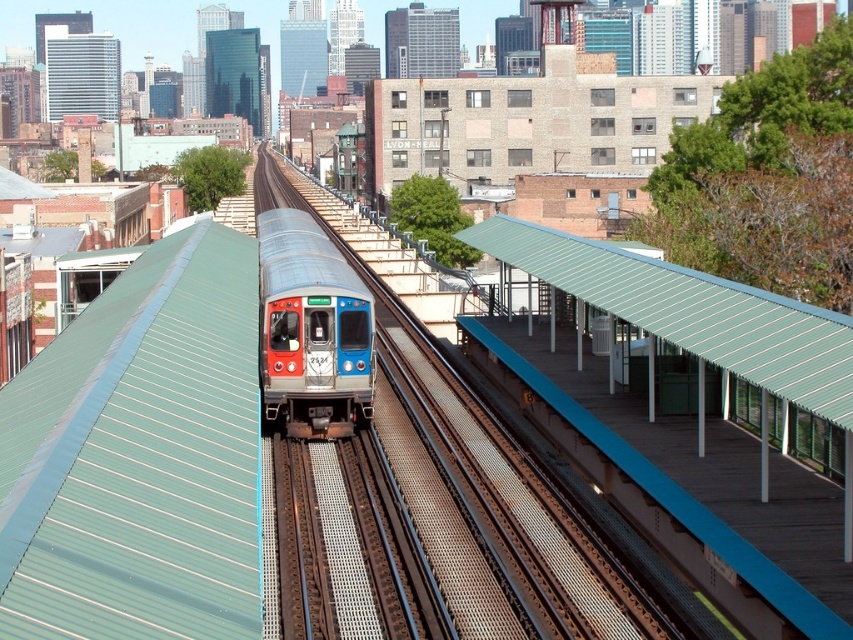
Is smooth steel train track at center in front of metallic blue train at center?

Yes, smooth steel train track at center is closer to the viewer.

Which is in front, point (572, 602) or point (294, 390)?

Point (572, 602) is in front.

Find the location of a particular element. smooth steel train track at center is located at coordinates (497, 500).

Who is more forward, (556, 282) or (332, 284)?

Point (332, 284) is more forward.

At what (x,y) coordinates should I click in order to perform the action: click on green metal platform at right. Please return your answer as a coordinate pair (x, y). This screenshot has width=853, height=640. Looking at the image, I should click on (692, 310).

Between point (788, 356) and point (270, 401), which one is positioned behind?

Positioned behind is point (270, 401).

Image resolution: width=853 pixels, height=640 pixels. I want to click on green metal platform at right, so click(692, 310).

Can you confirm if smooth steel train track at center is positioned to the right of green metal platform at right?

In fact, smooth steel train track at center is to the left of green metal platform at right.

The width and height of the screenshot is (853, 640). What do you see at coordinates (497, 500) in the screenshot?
I see `smooth steel train track at center` at bounding box center [497, 500].

The image size is (853, 640). What do you see at coordinates (497, 500) in the screenshot?
I see `smooth steel train track at center` at bounding box center [497, 500].

I want to click on smooth steel train track at center, so point(497,500).